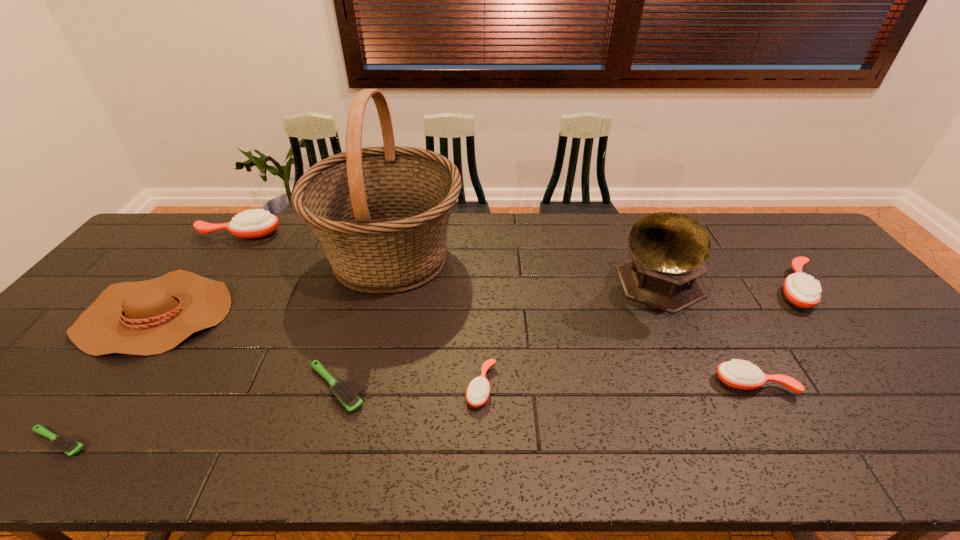
Where is `the smallest orange hairbrush`? the smallest orange hairbrush is located at coordinates (478, 391).

Find the location of `the farther light hairbrush`. the farther light hairbrush is located at coordinates (347, 396).

This screenshot has height=540, width=960. I want to click on the bigger light hairbrush, so click(347, 396).

Where is `the shortest hairbrush`? The width and height of the screenshot is (960, 540). the shortest hairbrush is located at coordinates (65, 443).

This screenshot has width=960, height=540. I want to click on the nearest object, so click(65, 443).

I want to click on free region located 0.170m on the left of the tallest object, so click(264, 256).

I want to click on blank space located on the horn direction of the second tallest object, so click(x=694, y=375).

Image resolution: width=960 pixels, height=540 pixels. I want to click on free spot located 0.130m on the right of the tallest hairbrush, so click(319, 234).

Where is `vacant space positioned on the front of the cowboy hat`? vacant space positioned on the front of the cowboy hat is located at coordinates (65, 430).

I want to click on vacant area situated on the front of the second biggest orange hairbrush, so click(x=841, y=345).